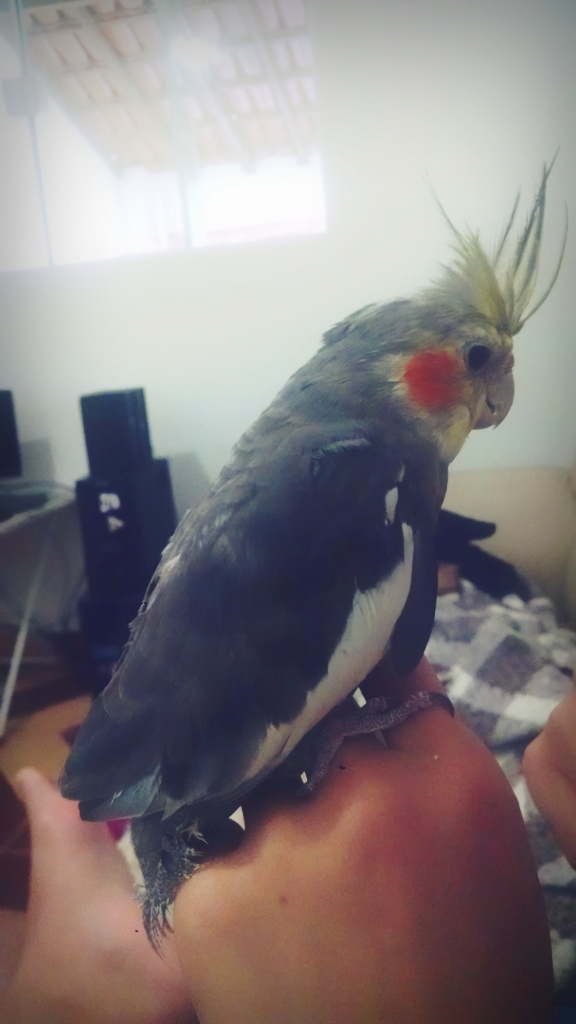
Where is `blue white and grey blanket`? This screenshot has height=1024, width=576. blue white and grey blanket is located at coordinates (507, 660), (532, 713), (486, 697).